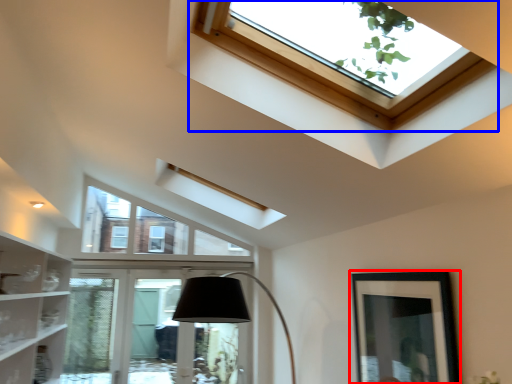
Question: Which object is closer to the camera taking this photo, picture frame (highlighted by a red box) or window (highlighted by a blue box)?

Choices:
 (A) picture frame
 (B) window

Answer: (B)